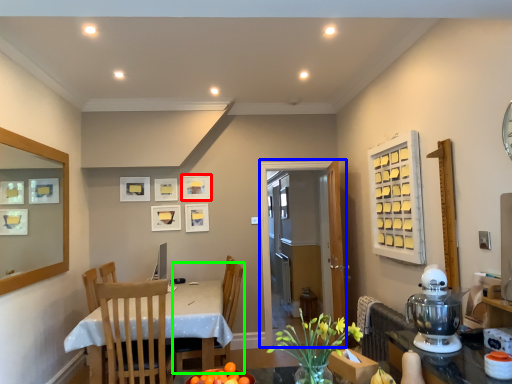
Question: Which object is the closest to the picture frame (highlighted by a red box)? Choose among these: glass door (highlighted by a blue box) or chair (highlighted by a green box).

Choices:
 (A) glass door
 (B) chair

Answer: (A)